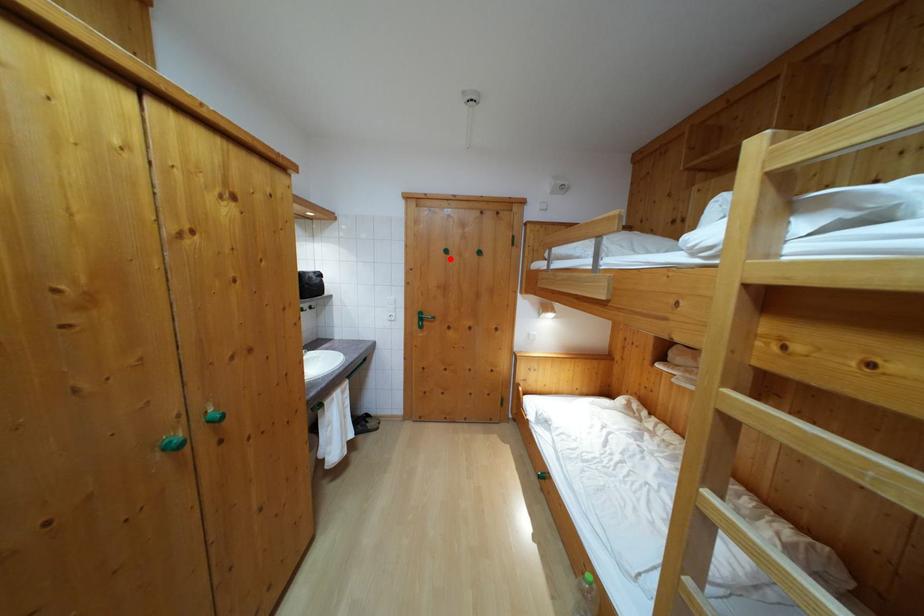
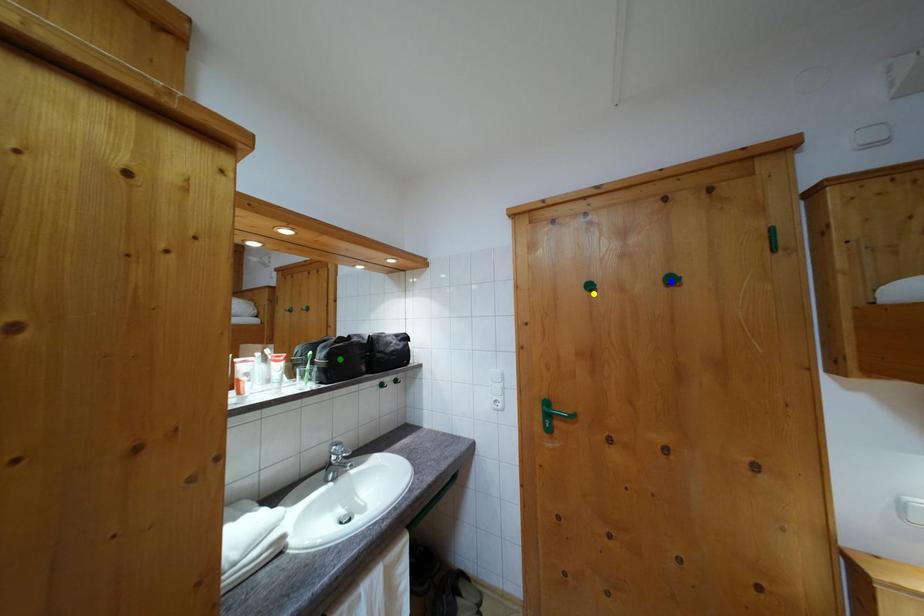
Question: I am providing you with two images of the same scene from different viewpoints. A red point is marked on the first image. You are given multiple points on the second image. Which spot in image 2 lines up with the point in image 1?

Choices:
 (A) yellow point
 (B) blue point
 (C) green point

Answer: (A)